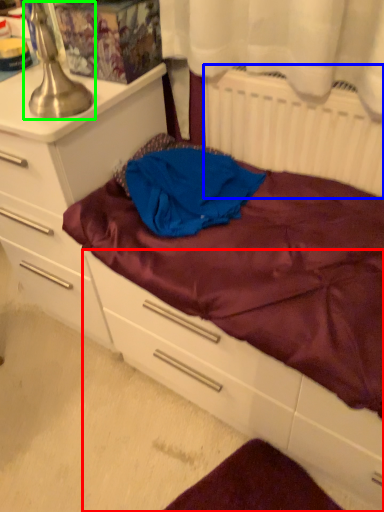
Question: Which is nearer to the drawer (highlighted by a red box)? radiator (highlighted by a blue box) or table lamp (highlighted by a green box).

Choices:
 (A) radiator
 (B) table lamp

Answer: (A)